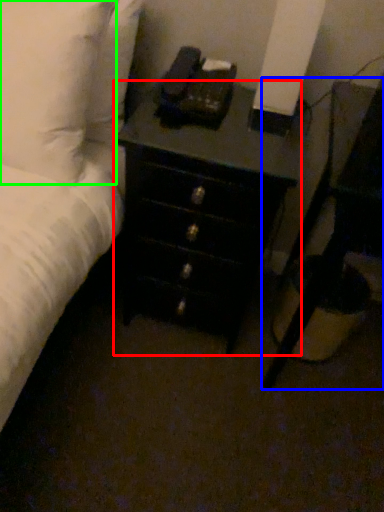
Question: Which object is the closest to the chest of drawers (highlighted by a red box)? Choose among these: nightstand (highlighted by a blue box) or pillow (highlighted by a green box).

Choices:
 (A) nightstand
 (B) pillow

Answer: (A)